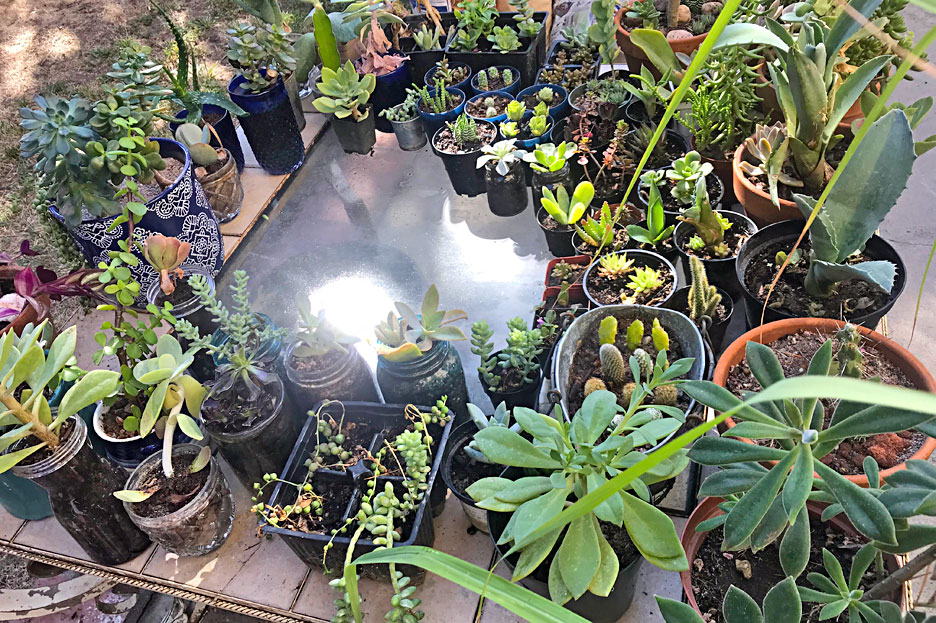
I want to click on jars, so click(440, 376), click(323, 384), click(255, 440), click(196, 505).